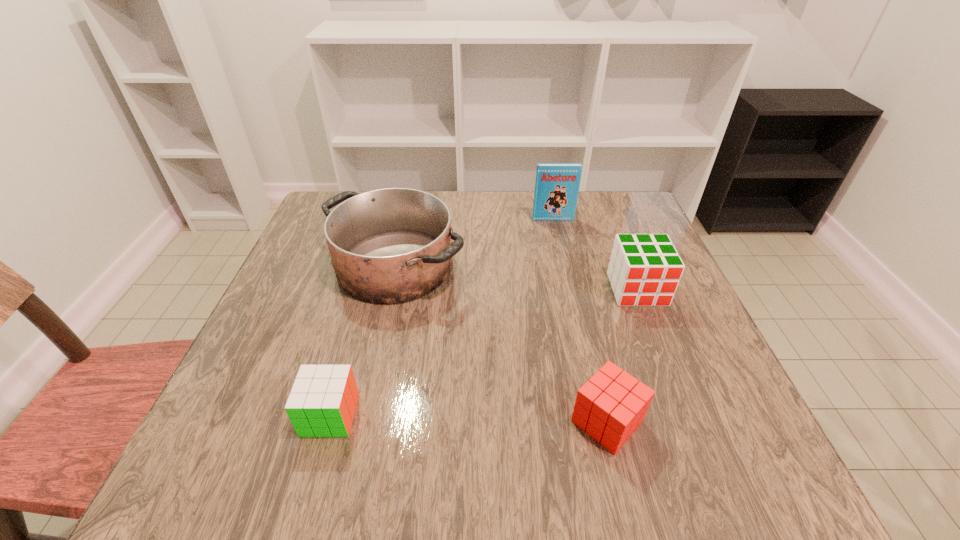
Identify the location of free location that satisfies the following two spatial constraints: 1. on the front cover of the book; 2. on the left side of the second cube from right to left. This screenshot has width=960, height=540. (598, 421).